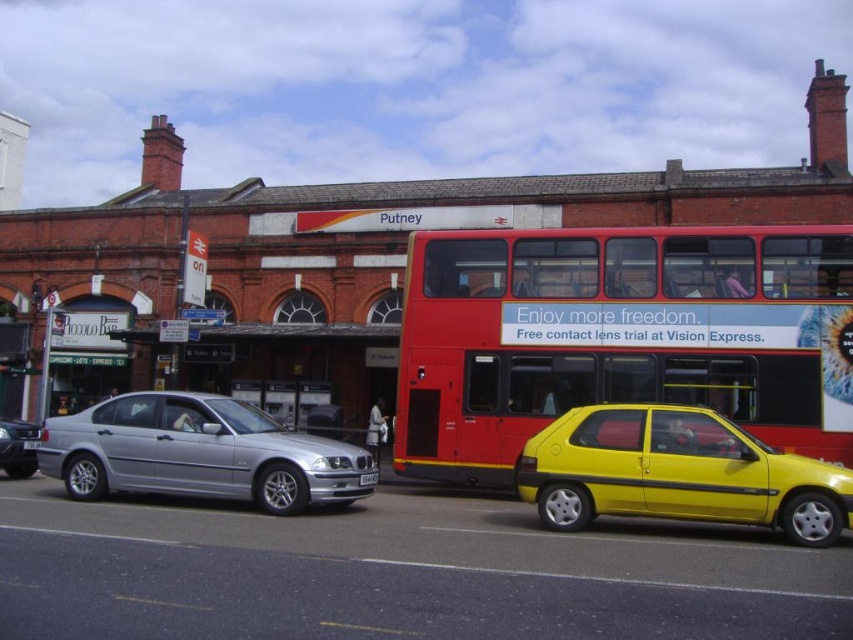
Does point (664, 451) come in front of point (368, 483)?

Yes, point (664, 451) is in front of point (368, 483).

In the scene shown: Does shiny yellow car at lower right lie behind white plastic license plate at center?

No, it is in front of white plastic license plate at center.

Which is in front, point (619, 515) or point (372, 477)?

Point (619, 515) is in front.

The width and height of the screenshot is (853, 640). What are the coordinates of `shiny yellow car at lower right` in the screenshot? It's located at (677, 472).

Is silver metallic sedan at center below black plastic license plate at center?

Yes, silver metallic sedan at center is below black plastic license plate at center.

Does silver metallic sedan at center appear on the left side of black plastic license plate at center?

Correct, you'll find silver metallic sedan at center to the left of black plastic license plate at center.

Which is in front, point (28, 422) or point (28, 438)?

Point (28, 438) is more forward.

This screenshot has height=640, width=853. In order to click on silver metallic sedan at center in this screenshot , I will do `click(18, 448)`.

Does red matte double-decker bus at center have a greater width compared to white plastic license plate at center?

Indeed, red matte double-decker bus at center has a greater width compared to white plastic license plate at center.

Between red matte double-decker bus at center and white plastic license plate at center, which one appears on the left side from the viewer's perspective?

Positioned to the left is white plastic license plate at center.

Is point (759, 289) more distant than point (364, 481)?

Yes.

This screenshot has height=640, width=853. I want to click on red matte double-decker bus at center, so click(x=619, y=337).